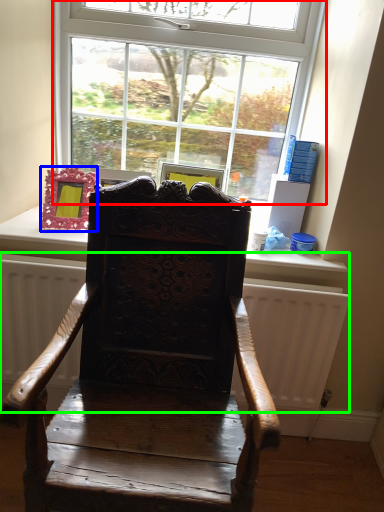
Question: Based on their relative distances, which object is nearer to window (highlighted by a red box)? Choose from picture frame (highlighted by a blue box) and radiator (highlighted by a green box).

Choices:
 (A) picture frame
 (B) radiator

Answer: (A)